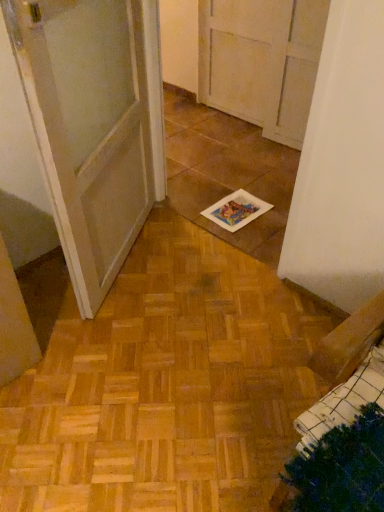
This screenshot has width=384, height=512. Identify the location of vacant area that lies to the right of white paper at center. (277, 206).